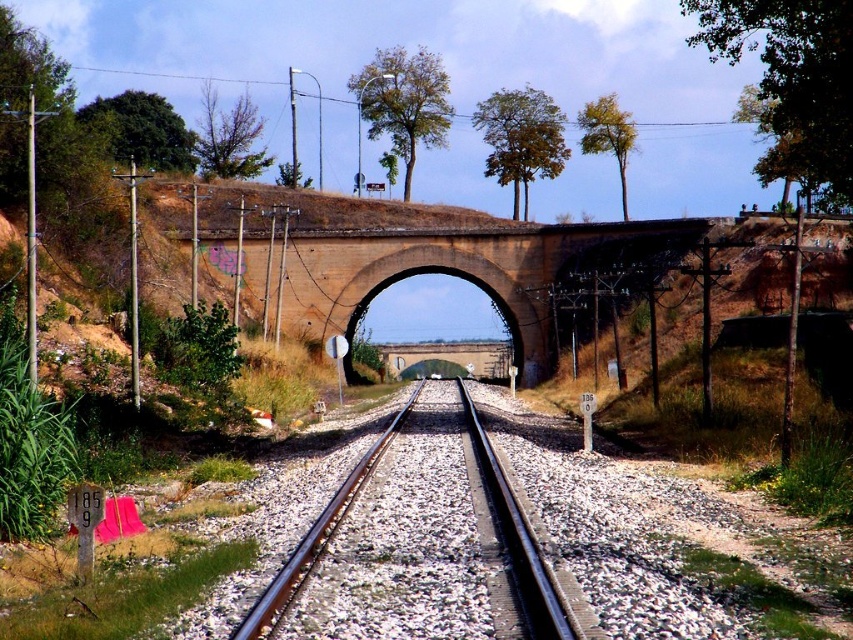
You are a railway inspector checking the alignment of the tracks. You notice the brown brick bridge at center and the black metal train track at center. Which structure is taller?

The brown brick bridge at center is taller than the black metal train track at center.

You are a train engineer approaching the railway tracks. You notice two points marked on your map at coordinates point [534,380] and point [476,481]. Which point is closer to your current position as you move along the tracks towards the bridge?

Point [476,481] is closer to your current position because it is in front of point [534,380] along the tracks.